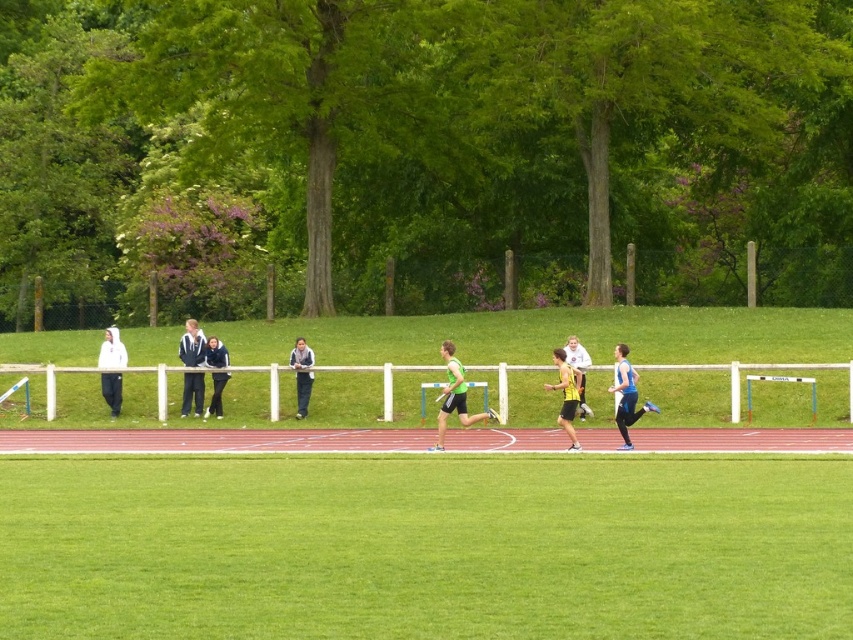
Based on the photo, you are standing at the position of the point labeled point (566, 374). You want to walk towards the point labeled point (225, 365). Based on the scene description, will you need to walk towards the background or the foreground?

You will need to walk towards the background because point (225, 365) is further away from the camera compared to point (566, 374).

You are a photographer positioned at the edge of the field. You want to take a photo that includes both the green fabric shorts at center and the light blue athletic top at center. What is the minimum distance you need to move backward to ensure both subjects are in frame?

The minimum distance you need to move backward is 4.67 meters to ensure both the green fabric shorts at center and the light blue athletic top at center are in frame.

In the scene shown: You are a photographer positioned at the back of the field. You want to take a photo of the green fabric shorts at center and the light blue athletic top at center without any obstruction. Based on their positions, which one should you focus on first to ensure both are in the frame?

The green fabric shorts at center is in front of the light blue athletic top at center. To ensure both are in the frame without obstruction, focus on the light blue athletic top at center first, as it is behind the green fabric shorts at center and might be partially hidden if not properly framed.